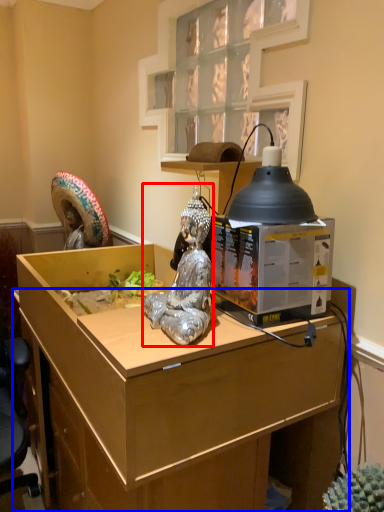
Question: Which object appears farthest to the camera in this image, person (highlighted by a red box) or desk (highlighted by a blue box)?

Choices:
 (A) person
 (B) desk

Answer: (A)